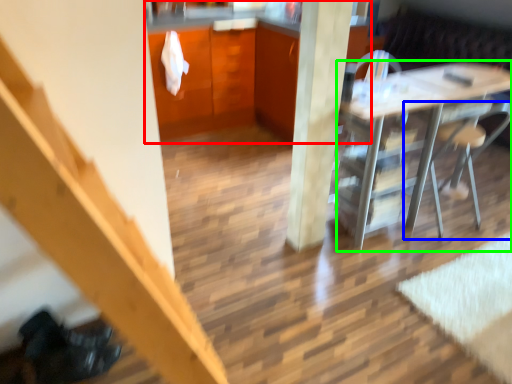
Question: Estimate the real-world distances between objects in this image. Which object is closer to cabinetry (highlighted by a red box), chair (highlighted by a blue box) or desk (highlighted by a green box)?

Choices:
 (A) chair
 (B) desk

Answer: (B)